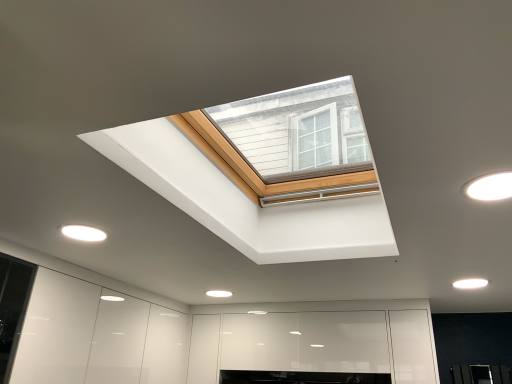
Question: Is white matte light fixture at lower right, which appears as the first lighting when viewed from the right, at the right side of white glossy light fixture at lower left, positioned as the 3th lighting in right-to-left order?

Choices:
 (A) no
 (B) yes

Answer: (B)

Question: Considering the relative sizes of white matte light fixture at lower right, the first lighting in the bottom-to-top sequence, and white glossy light fixture at lower left, arranged as the 2th lighting when ordered from the bottom, in the image provided, is white matte light fixture at lower right, the first lighting in the bottom-to-top sequence, shorter than white glossy light fixture at lower left, arranged as the 2th lighting when ordered from the bottom,?

Choices:
 (A) no
 (B) yes

Answer: (A)

Question: From a real-world perspective, is white matte light fixture at lower right, the first lighting in the bottom-to-top sequence, on white glossy light fixture at lower left, the second lighting positioned from the top?

Choices:
 (A) no
 (B) yes

Answer: (B)

Question: Is white matte light fixture at lower right, which ranks as the 3th lighting in top-to-bottom order, taller than white glossy light fixture at lower left, the 1th lighting when ordered from left to right?

Choices:
 (A) yes
 (B) no

Answer: (A)

Question: Is white matte light fixture at lower right, the 1th lighting when ordered from back to front, to the left of white glossy light fixture at lower left, marked as the 2th lighting in a back-to-front arrangement, from the viewer's perspective?

Choices:
 (A) yes
 (B) no

Answer: (B)

Question: Is white matte light fixture at lower right, the 1th lighting when ordered from back to front, next to white glossy light fixture at lower left, the 1th lighting when ordered from left to right?

Choices:
 (A) no
 (B) yes

Answer: (A)

Question: Is white matte light fixture at upper right, the 1th lighting positioned from the top, touching white glossy light fixture at lower left, placed as the second lighting when sorted from front to back?

Choices:
 (A) no
 (B) yes

Answer: (A)

Question: Is white matte light fixture at upper right, which is the 2th lighting in left-to-right order, oriented towards white glossy light fixture at lower left, the 1th lighting when ordered from left to right?

Choices:
 (A) no
 (B) yes

Answer: (A)

Question: From the image's perspective, does white matte light fixture at upper right, which appears as the 3th lighting when viewed from the back, appear lower than white glossy light fixture at lower left, the second lighting positioned from the top?

Choices:
 (A) no
 (B) yes

Answer: (A)

Question: Is white matte light fixture at upper right, which is the 2th lighting in left-to-right order, completely or partially outside of white glossy light fixture at lower left, placed as the second lighting when sorted from front to back?

Choices:
 (A) yes
 (B) no

Answer: (A)

Question: Can you confirm if white matte light fixture at upper right, which appears as the 3th lighting when viewed from the back, is smaller than white glossy light fixture at lower left, positioned as the 3th lighting in right-to-left order?

Choices:
 (A) yes
 (B) no

Answer: (B)

Question: Can you confirm if white matte light fixture at upper right, which appears as the 3th lighting when viewed from the back, is positioned to the right of white glossy light fixture at lower left, the second lighting positioned from the top?

Choices:
 (A) no
 (B) yes

Answer: (B)

Question: From a real-world perspective, is white matte light fixture at upper right, the 1th lighting positioned from the top, on top of white matte light fixture at lower right, which ranks as the 3th lighting in top-to-bottom order?

Choices:
 (A) yes
 (B) no

Answer: (A)